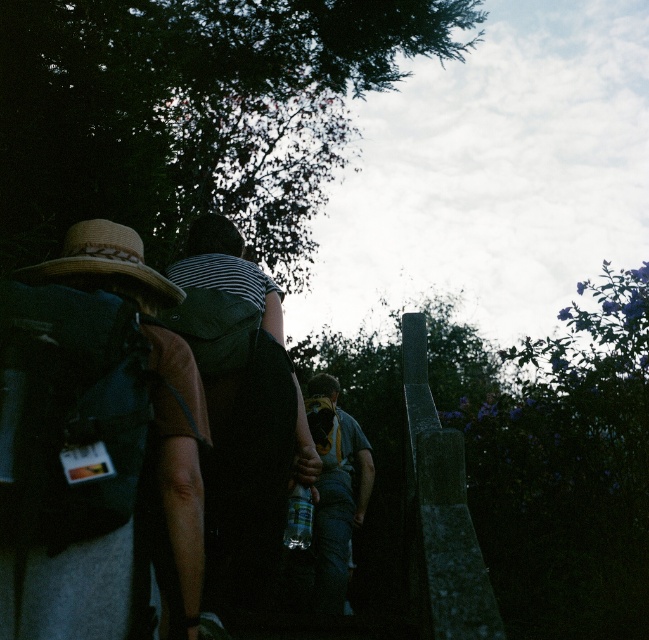
Question: Can you confirm if denim jeans at center is bigger than straw hat at upper left?

Choices:
 (A) yes
 (B) no

Answer: (A)

Question: Is striped fabric shirt at center below denim jeans at center?

Choices:
 (A) no
 (B) yes

Answer: (A)

Question: Which of these objects is positioned closest to the striped fabric shirt at center?

Choices:
 (A) denim jeans at center
 (B) matte straw hat at left

Answer: (B)

Question: Estimate the real-world distances between objects in this image. Which object is closer to the denim jeans at center?

Choices:
 (A) striped fabric shirt at center
 (B) matte straw hat at left

Answer: (A)

Question: Which of the following is the closest to the observer?

Choices:
 (A) matte straw hat at left
 (B) striped fabric shirt at center

Answer: (A)

Question: Does denim jeans at center appear under straw hat at upper left?

Choices:
 (A) yes
 (B) no

Answer: (A)